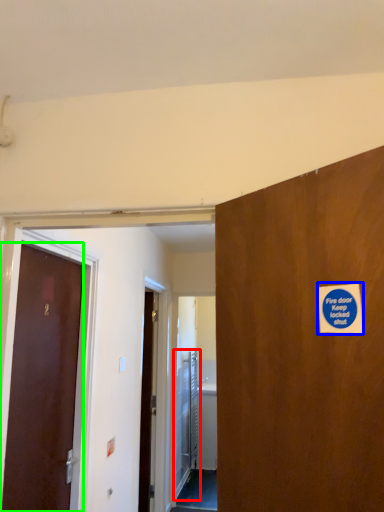
Question: Estimate the real-world distances between objects in this image. Which object is farther from elevator door (highlighted by a red box), sticker (highlighted by a blue box) or door (highlighted by a green box)?

Choices:
 (A) sticker
 (B) door

Answer: (A)